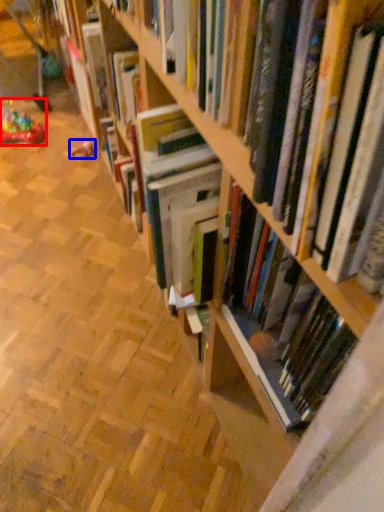
Question: Which of the following is the farthest to the observer, toy (highlighted by a red box) or toy (highlighted by a blue box)?

Choices:
 (A) toy
 (B) toy

Answer: (B)